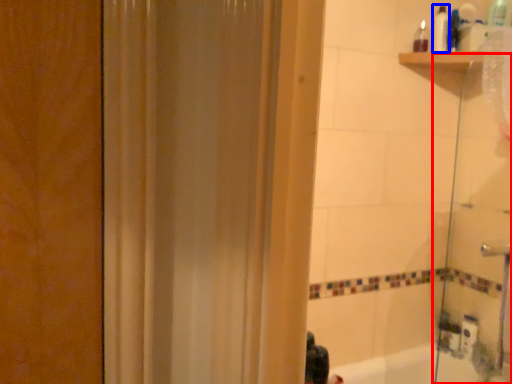
Question: Which object is closer to the camera taking this photo, shower door (highlighted by a red box) or toiletry (highlighted by a blue box)?

Choices:
 (A) shower door
 (B) toiletry

Answer: (A)